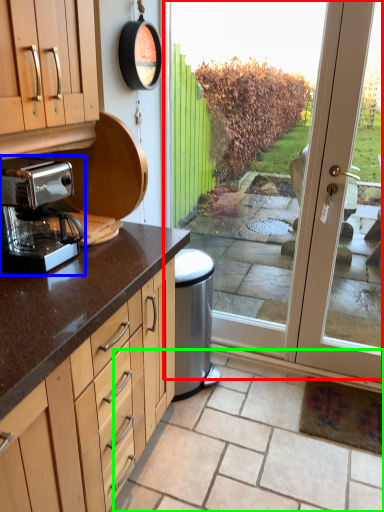
Question: Considering the real-world distances, which object is farthest from screen door (highlighted by a red box)? coffee maker (highlighted by a blue box) or tile (highlighted by a green box)?

Choices:
 (A) coffee maker
 (B) tile

Answer: (B)